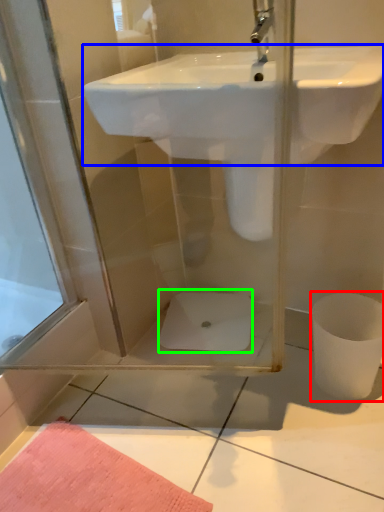
Question: Which object is the farthest from toilet bowl (highlighted by a red box)? Choose among these: sink (highlighted by a blue box) or toilet bowl (highlighted by a green box).

Choices:
 (A) sink
 (B) toilet bowl

Answer: (A)